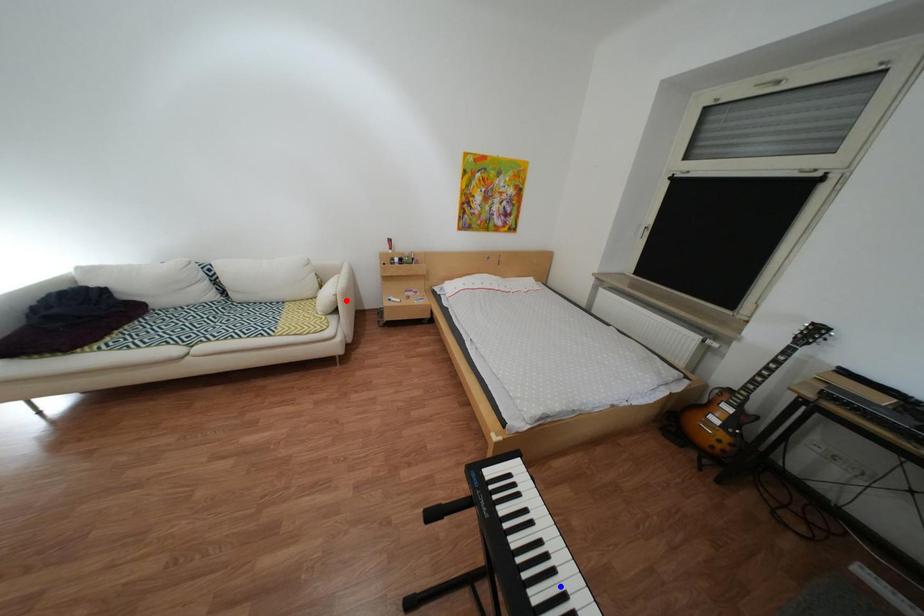
Question: In the image, two points are highlighted. Which point is nearer to the camera? Reply with the corresponding letter.

Choices:
 (A) blue point
 (B) red point

Answer: (A)